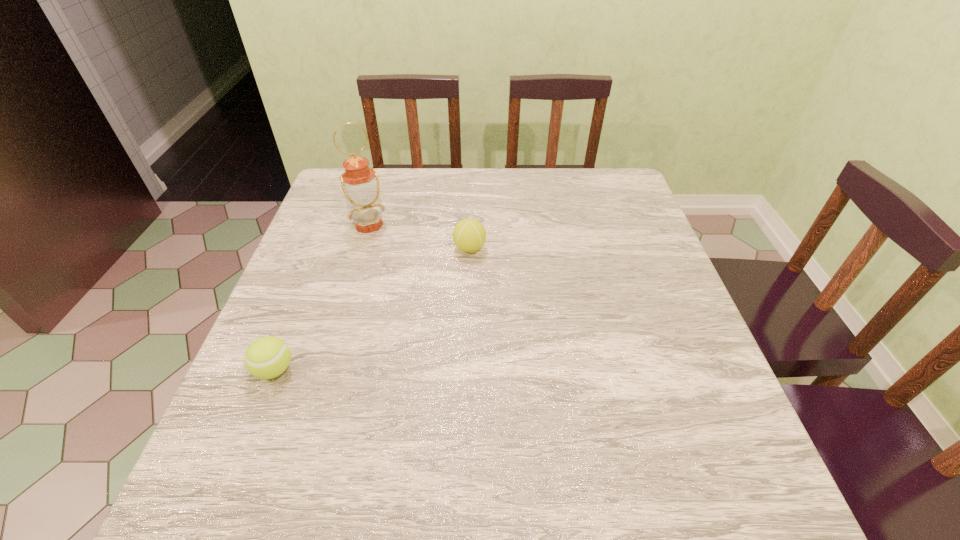
The image size is (960, 540). Find the location of `tennis ball that is at the left edge`. tennis ball that is at the left edge is located at coordinates (267, 357).

Where is `blank space at the far edge of the desktop`? blank space at the far edge of the desktop is located at coordinates (551, 200).

You are a GUI agent. You are given a task and a screenshot of the screen. Output one action in this format:
    pyautogui.click(x=<x>, y=<y>)
    Task: Click on the free point at the near edge
    
    Given the screenshot: What is the action you would take?
    pyautogui.click(x=350, y=480)

This screenshot has height=540, width=960. I want to click on vacant space at the left edge, so click(x=280, y=307).

In the image, there is a desktop. Find the location of `vacant space at the right edge`. vacant space at the right edge is located at coordinates click(677, 302).

The height and width of the screenshot is (540, 960). I want to click on empty space between the right tennis ball and the nearest object, so click(x=372, y=309).

Identify the location of vacant area that lies between the second object from right to left and the nearest object. This screenshot has width=960, height=540. (322, 298).

Find the location of a particular element. This screenshot has height=540, width=960. free space between the farthest object and the nearer tennis ball is located at coordinates (322, 298).

Find the location of a particular element. free space between the farthest object and the rightmost object is located at coordinates (420, 237).

You are a GUI agent. You are given a task and a screenshot of the screen. Output one action in this format:
    pyautogui.click(x=<x>, y=<y>)
    Task: Click on the unoccupied position between the farthest object and the nearer tennis ball
    The height and width of the screenshot is (540, 960).
    Given the screenshot: What is the action you would take?
    pyautogui.click(x=322, y=298)